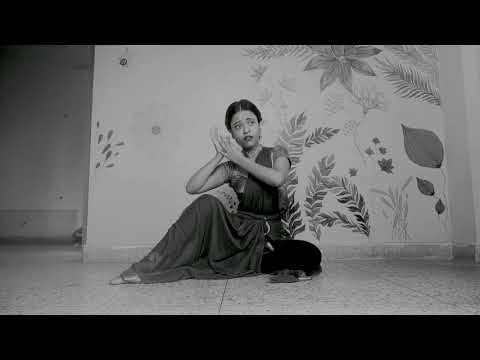
Find the location of a particular element. floor is located at coordinates (212, 295).